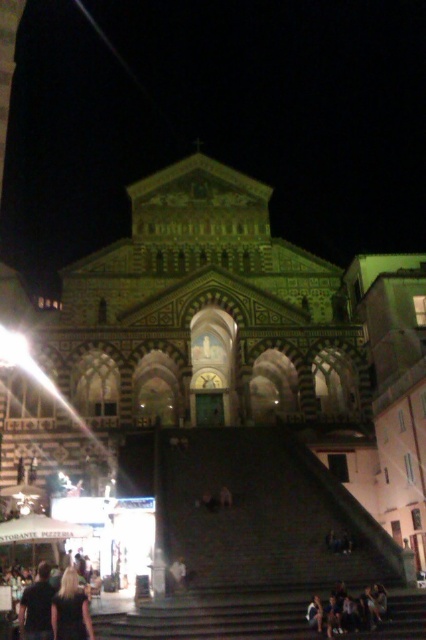
Between dark blue jeans at lower center and black fabric at lower left, which one is positioned lower?

Positioned lower is dark blue jeans at lower center.

Which of these two, dark blue jeans at lower center or black fabric at lower left, stands shorter?

dark blue jeans at lower center is shorter.

Does point (376, 605) lie behind point (66, 570)?

No, (376, 605) is closer to viewer.

Locate an element on the screen. This screenshot has width=426, height=640. dark blue jeans at lower center is located at coordinates (348, 611).

Who is positioned more to the right, dark blue jeans at lower center or dark brown leather jacket at lower left?

dark blue jeans at lower center

Is dark blue jeans at lower center taller than dark brown leather jacket at lower left?

No, dark blue jeans at lower center is not taller than dark brown leather jacket at lower left.

Identify the location of dark blue jeans at lower center. (348, 611).

Locate an element on the screen. The height and width of the screenshot is (640, 426). dark blue jeans at lower center is located at coordinates (348, 611).

Does black fabric at lower left have a greater width compared to dark brown leather jacket at lower left?

Yes.

Consider the image. Measure the distance between black fabric at lower left and dark brown leather jacket at lower left.

Result: black fabric at lower left is 2.02 meters away from dark brown leather jacket at lower left.

Who is more forward, (62,604) or (37,588)?

Point (62,604) is in front.

Identify the location of black fabric at lower left. Image resolution: width=426 pixels, height=640 pixels. (71, 609).